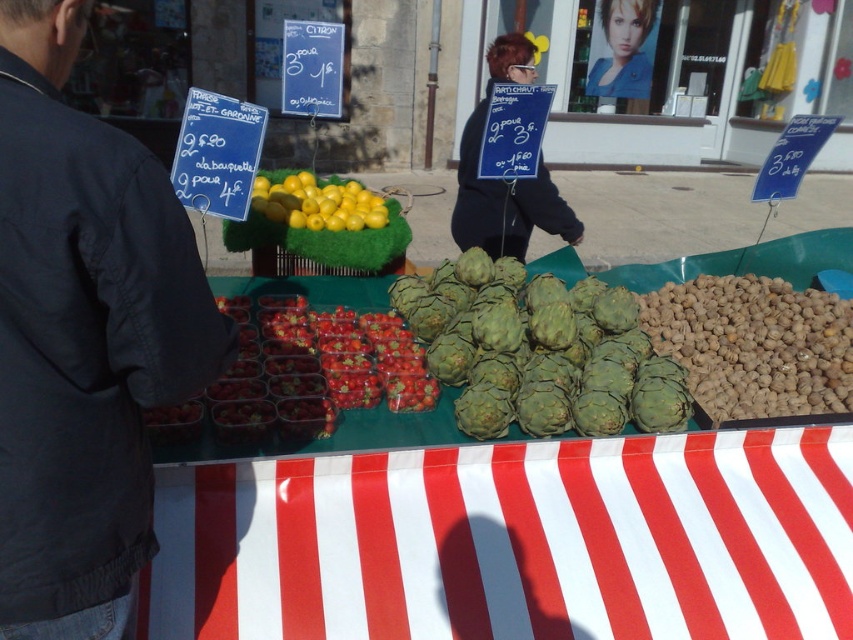
Is green rough artichoke at center smaller than dark blue fabric sign at center?

Indeed, green rough artichoke at center has a smaller size compared to dark blue fabric sign at center.

Who is taller, green rough artichoke at center or dark blue fabric sign at center?

Standing taller between the two is dark blue fabric sign at center.

Between point (498, 339) and point (548, 196), which one is positioned behind?

Point (548, 196)

Locate an element on the screen. This screenshot has width=853, height=640. green rough artichoke at center is located at coordinates (538, 352).

Who is shorter, brown rough walnut at right or yellow smooth lemons at center?

yellow smooth lemons at center is shorter.

What do you see at coordinates (753, 346) in the screenshot?
I see `brown rough walnut at right` at bounding box center [753, 346].

This screenshot has height=640, width=853. Find the location of `brown rough walnut at right`. brown rough walnut at right is located at coordinates [x=753, y=346].

Measure the distance between green rough artichoke at center and yellow smooth lemons at center.

The distance of green rough artichoke at center from yellow smooth lemons at center is 31.76 inches.

Identify the location of green rough artichoke at center. (538, 352).

Is point (440, 339) in front of point (280, 193)?

Yes.

Identify the location of green rough artichoke at center. Image resolution: width=853 pixels, height=640 pixels. (538, 352).